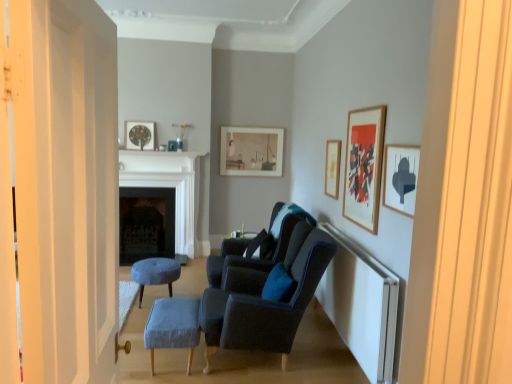
The height and width of the screenshot is (384, 512). What are the coordinates of `matte black picture frame at upper right, arranged as the 1th picture frame when viewed from the front` in the screenshot? It's located at (400, 177).

Where is `black stone fireplace at center, which is the 1th fireplace in back-to-front order`? Image resolution: width=512 pixels, height=384 pixels. black stone fireplace at center, which is the 1th fireplace in back-to-front order is located at coordinates (146, 223).

Find the location of a particular element. velvet blue stool at center, the 2th stool from the front is located at coordinates (155, 273).

What do you see at coordinates (59, 191) in the screenshot? I see `white painted wood door at left` at bounding box center [59, 191].

Identify the location of matte black picture frame at upper right, the 1th picture frame when ordered from right to left. (400, 177).

Is velvet blue stool at center, the 2th stool viewed from the right, not inside velvet dark blue armchair at center, arranged as the 1th chair when viewed from the back?

Absolutely, velvet blue stool at center, the 2th stool viewed from the right, is external to velvet dark blue armchair at center, arranged as the 1th chair when viewed from the back.

Would you say velvet blue stool at center, the 2th stool from the front, is to the left or to the right of velvet dark blue armchair at center, arranged as the 1th chair when viewed from the back, in the picture?

velvet blue stool at center, the 2th stool from the front, is positioned on velvet dark blue armchair at center, arranged as the 1th chair when viewed from the back,'s left side.

From a real-world perspective, is velvet blue stool at center, the 2th stool viewed from the right, located beneath velvet dark blue armchair at center, the 2th chair viewed from the front?

Yes, from a real-world perspective, velvet blue stool at center, the 2th stool viewed from the right, is beneath velvet dark blue armchair at center, the 2th chair viewed from the front.

Does matte black picture frame at upper right, which is the 5th picture frame from left to right, come behind wooden framed artwork at upper right, which ranks as the 2th picture frame in front-to-back order?

No.

Which of these two, matte black picture frame at upper right, which is the 5th picture frame from left to right, or wooden framed artwork at upper right, marked as the second picture frame in a right-to-left arrangement, is smaller?

matte black picture frame at upper right, which is the 5th picture frame from left to right, is smaller.

Considering the relative positions of matte black picture frame at upper right, which ranks as the fifth picture frame in back-to-front order, and wooden framed artwork at upper right, which is counted as the 4th picture frame, starting from the back, in the image provided, is matte black picture frame at upper right, which ranks as the fifth picture frame in back-to-front order, to the left of wooden framed artwork at upper right, which is counted as the 4th picture frame, starting from the back, from the viewer's perspective?

In fact, matte black picture frame at upper right, which ranks as the fifth picture frame in back-to-front order, is to the right of wooden framed artwork at upper right, which is counted as the 4th picture frame, starting from the back.

Is matte black picture frame at upper right, which is the 5th picture frame from left to right, placed right next to wooden framed artwork at upper right, which is counted as the 4th picture frame, starting from the back?

matte black picture frame at upper right, which is the 5th picture frame from left to right, is not next to wooden framed artwork at upper right, which is counted as the 4th picture frame, starting from the back, and they're not touching.

Considering the relative sizes of white plastic radiator at right and velvet blue stool at center, the first stool viewed from the left, in the image provided, is white plastic radiator at right smaller than velvet blue stool at center, the first stool viewed from the left,?

No.

In the scene shown: Is white plastic radiator at right directly adjacent to velvet blue stool at center, the first stool viewed from the left?

No, white plastic radiator at right is not next to velvet blue stool at center, the first stool viewed from the left.

What's the angular difference between white plastic radiator at right and velvet blue stool at center, the first stool viewed from the left,'s facing directions?

The angle between the facing direction of white plastic radiator at right and the facing direction of velvet blue stool at center, the first stool viewed from the left, is 0.379 degrees.

Is white plastic radiator at right aimed at velvet blue stool at center, which is the first stool in back-to-front order?

Yes, white plastic radiator at right is oriented towards velvet blue stool at center, which is the first stool in back-to-front order.

Considering the positions of objects matte black side table at center and suede dark blue armchair at center, arranged as the 2th chair when viewed from the back, in the image provided, who is behind, matte black side table at center or suede dark blue armchair at center, arranged as the 2th chair when viewed from the back,?

Positioned behind is matte black side table at center.

Is matte black side table at center located outside suede dark blue armchair at center, arranged as the 2th chair when viewed from the back?

That's correct, matte black side table at center is outside of suede dark blue armchair at center, arranged as the 2th chair when viewed from the back.

Between matte black side table at center and suede dark blue armchair at center, the 1th chair when ordered from front to back, which one has smaller size?

With smaller size is matte black side table at center.

From a real-world perspective, is matte black side table at center located beneath suede dark blue armchair at center, arranged as the 2th chair when viewed from the back?

Actually, matte black side table at center is physically above suede dark blue armchair at center, arranged as the 2th chair when viewed from the back, in the real world.

This screenshot has width=512, height=384. Identify the location of door that is below the matte white picture frame at center, the 2th picture frame positioned from the left (from the image's perspective). (59, 191).

Is matte white picture frame at center, the 2th picture frame positioned from the left, surrounded by white painted wood door at left?

That's incorrect, matte white picture frame at center, the 2th picture frame positioned from the left, is not inside white painted wood door at left.

How far apart are white painted wood door at left and matte white picture frame at center, the 2th picture frame positioned from the left?

white painted wood door at left is 4.34 meters away from matte white picture frame at center, the 2th picture frame positioned from the left.

Which object is wider, white painted wood door at left or matte white picture frame at center, acting as the 4th picture frame starting from the right?

With larger width is white painted wood door at left.

Which object is positioned more to the left, white plastic radiator at right or white marble fireplace at center, which is counted as the first fireplace, starting from the front?

white marble fireplace at center, which is counted as the first fireplace, starting from the front, is more to the left.

Considering the relative sizes of white plastic radiator at right and white marble fireplace at center, which is counted as the first fireplace, starting from the front, in the image provided, is white plastic radiator at right smaller than white marble fireplace at center, which is counted as the first fireplace, starting from the front,?

Yes.

From the image's perspective, relative to white marble fireplace at center, which is counted as the 2th fireplace, starting from the back, is white plastic radiator at right above or below?

white plastic radiator at right is situated lower than white marble fireplace at center, which is counted as the 2th fireplace, starting from the back, in the image.

From a real-world perspective, who is located higher, black stone fireplace at center, which is the second fireplace from front to back, or matte white picture frame at center, the 2th picture frame positioned from the left?

matte white picture frame at center, the 2th picture frame positioned from the left, from a real-world perspective.

Is black stone fireplace at center, which is the second fireplace from front to back, in contact with matte white picture frame at center, the fifth picture frame positioned from the front?

No, black stone fireplace at center, which is the second fireplace from front to back, is not beside matte white picture frame at center, the fifth picture frame positioned from the front.

Looking at this image, how different are the orientations of black stone fireplace at center, which is the 1th fireplace in back-to-front order, and matte white picture frame at center, the 1th picture frame in the back-to-front sequence, in degrees?

The facing directions of black stone fireplace at center, which is the 1th fireplace in back-to-front order, and matte white picture frame at center, the 1th picture frame in the back-to-front sequence, are 0.818 degrees apart.

Is black stone fireplace at center, which is the 1th fireplace in back-to-front order, further to the viewer compared to matte white picture frame at center, the 2th picture frame positioned from the left?

No, black stone fireplace at center, which is the 1th fireplace in back-to-front order, is closer to the viewer.

Locate an element on the screen. This screenshot has height=384, width=512. the 1st chair counting from the right side of the velvet blue stool at center, which is the first stool in back-to-front order is located at coordinates (257, 246).

From the matte black picture frame at upper right, which ranks as the fifth picture frame in back-to-front order, count the 1st picture frame to the left and point to it. Please provide its 2D coordinates.

[(364, 166)]

Based on their spatial positions, is matte black picture frame at upper right, the 1th picture frame when ordered from right to left, or suede dark blue armchair at center, arranged as the 2th chair when viewed from the back, closer to velvet dark blue armchair at center, arranged as the 1th chair when viewed from the back?

suede dark blue armchair at center, arranged as the 2th chair when viewed from the back, lies closer to velvet dark blue armchair at center, arranged as the 1th chair when viewed from the back, than the other object.

When comparing their distances from blue fabric stool at lower center, which ranks as the 1th stool in right-to-left order, does matte black side table at center or white marble fireplace at center, which is counted as the first fireplace, starting from the front, seem further?

white marble fireplace at center, which is counted as the first fireplace, starting from the front.

From the image, which object appears to be nearer to velvet blue stool at center, which is the first stool in back-to-front order, blue fabric stool at lower center, which ranks as the 1th stool in right-to-left order, or matte black picture frame at upper right, which is the 5th picture frame from left to right?

blue fabric stool at lower center, which ranks as the 1th stool in right-to-left order.

When comparing their distances from blue fabric stool at lower center, which ranks as the 1th stool in front-to-back order, does black stone fireplace at center, which is the 1th fireplace in back-to-front order, or suede dark blue armchair at center, the 1th chair when ordered from front to back, seem closer?

suede dark blue armchair at center, the 1th chair when ordered from front to back, is positioned closer to the anchor blue fabric stool at lower center, which ranks as the 1th stool in front-to-back order.

From the picture: When comparing their distances from wooden framed artwork at upper right, which is counted as the 4th picture frame, starting from the back, does blue fabric stool at lower center, positioned as the 2th stool in back-to-front order, or white plastic radiator at right seem closer?

white plastic radiator at right is closer to wooden framed artwork at upper right, which is counted as the 4th picture frame, starting from the back.

Estimate the real-world distances between objects in this image. Which object is closer to white painted wood door at left, wooden framed artwork at upper right, marked as the 4th picture frame in a left-to-right arrangement, or suede dark blue armchair at center, the 1th chair when ordered from front to back?

suede dark blue armchair at center, the 1th chair when ordered from front to back, is positioned closer to the anchor white painted wood door at left.

Looking at the image, which one is located further to wooden clock at upper center, which is the 4th picture frame from front to back, white painted wood door at left or velvet blue stool at center, the first stool viewed from the left?

white painted wood door at left.

Considering their positions, is matte gold picture frame at upper right, the third picture frame viewed from the right, positioned further to suede dark blue armchair at center, the 1th chair when ordered from front to back, than matte black picture frame at upper right, arranged as the 1th picture frame when viewed from the front?

matte gold picture frame at upper right, the third picture frame viewed from the right, is further to suede dark blue armchair at center, the 1th chair when ordered from front to back.

Where is `radiator between matte black picture frame at upper right, arranged as the 1th picture frame when viewed from the front, and matte gold picture frame at upper right, the 3th picture frame when ordered from left to right, in the front-back direction`? This screenshot has height=384, width=512. radiator between matte black picture frame at upper right, arranged as the 1th picture frame when viewed from the front, and matte gold picture frame at upper right, the 3th picture frame when ordered from left to right, in the front-back direction is located at coordinates (361, 305).

This screenshot has width=512, height=384. I want to click on chair between suede dark blue armchair at center, the 1th chair when ordered from front to back, and matte white picture frame at center, the 2th picture frame positioned from the left, along the z-axis, so click(257, 246).

Locate an element on the screen. side table located between velvet dark blue armchair at center, arranged as the 1th chair when viewed from the back, and wooden clock at upper center, marked as the 1th picture frame in a left-to-right arrangement, in the depth direction is located at coordinates (236, 244).

Locate an element on the screen. Image resolution: width=512 pixels, height=384 pixels. picture frame positioned between white plastic radiator at right and velvet dark blue armchair at center, arranged as the 1th chair when viewed from the back, from near to far is located at coordinates (364, 166).